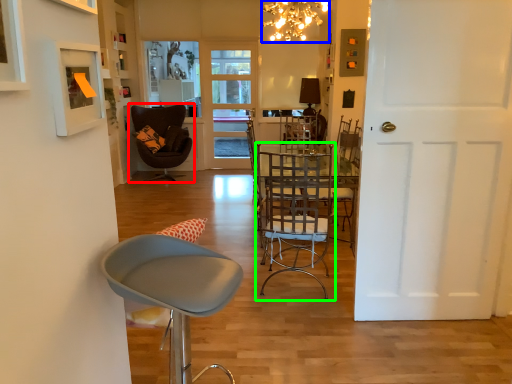
Question: Which is nearer to the chair (highlighted by a red box)? lamp (highlighted by a blue box) or chair (highlighted by a green box).

Choices:
 (A) lamp
 (B) chair

Answer: (A)